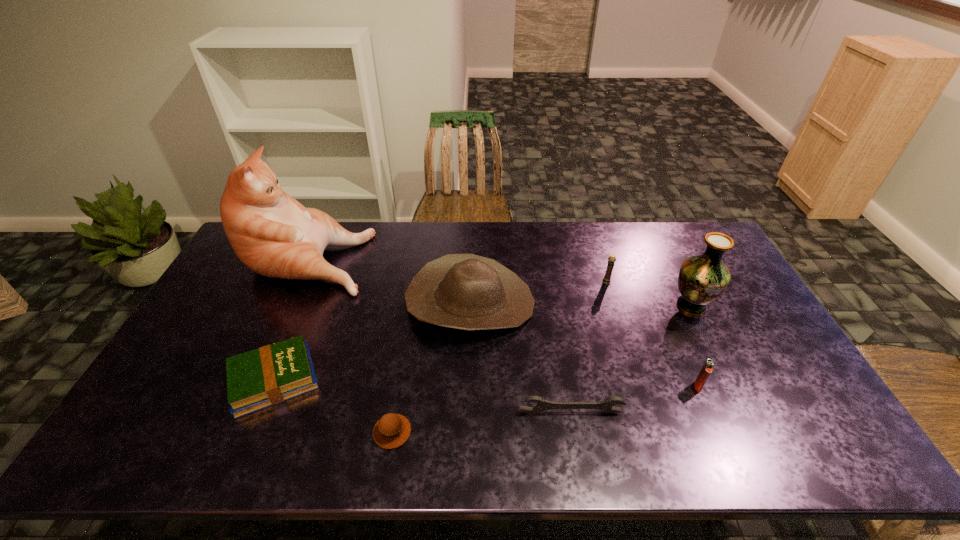
Find the location of `vacant space that's between the sixth shortest object and the wrench`. vacant space that's between the sixth shortest object and the wrench is located at coordinates (520, 357).

Locate an element on the screen. Image resolution: width=960 pixels, height=540 pixels. unoccupied position between the wrench and the second tallest object is located at coordinates (631, 359).

In order to click on free space between the vase and the third tallest object in this screenshot , I will do `click(581, 304)`.

Where is `unoccupied area between the sixth object from left to right and the muffin`? unoccupied area between the sixth object from left to right and the muffin is located at coordinates (499, 357).

Locate an element on the screen. vacant space that is in between the vase and the igniter is located at coordinates (694, 346).

Locate an element on the screen. The width and height of the screenshot is (960, 540). empty space between the rightmost object and the fourth shortest object is located at coordinates (694, 346).

The width and height of the screenshot is (960, 540). I want to click on unoccupied area between the tallest object and the muffin, so click(351, 344).

At what (x,y) coordinates should I click in order to perform the action: click on free space between the seventh shortest object and the second object from right to left. Please return your answer as a coordinate pair (x, y). Looking at the image, I should click on (694, 346).

This screenshot has height=540, width=960. Find the location of `vacant point located between the candle holder and the wrench`. vacant point located between the candle holder and the wrench is located at coordinates (588, 347).

At what (x,y) coordinates should I click in order to perform the action: click on free space between the cat and the cowboy hat. Please return your answer as a coordinate pair (x, y). The width and height of the screenshot is (960, 540). Looking at the image, I should click on (390, 279).